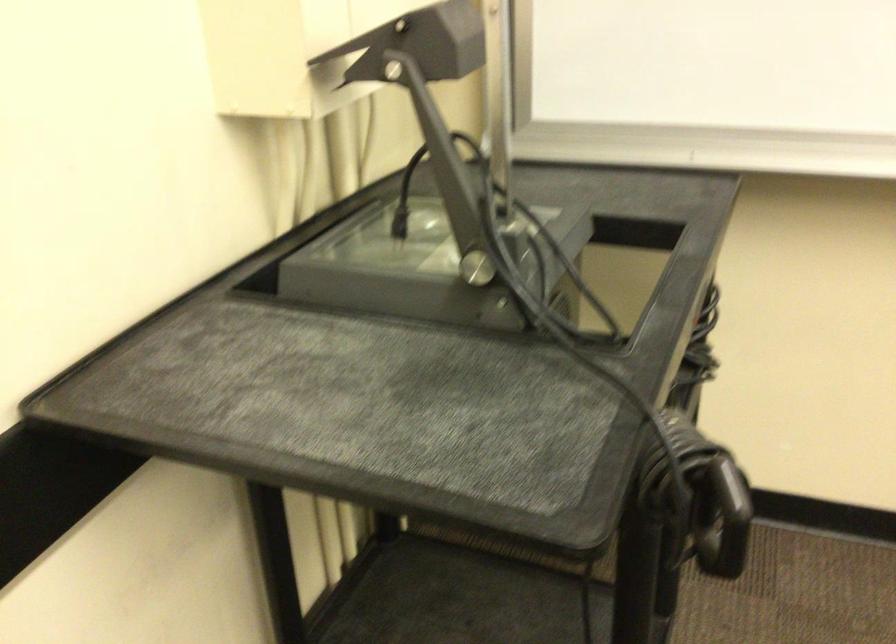
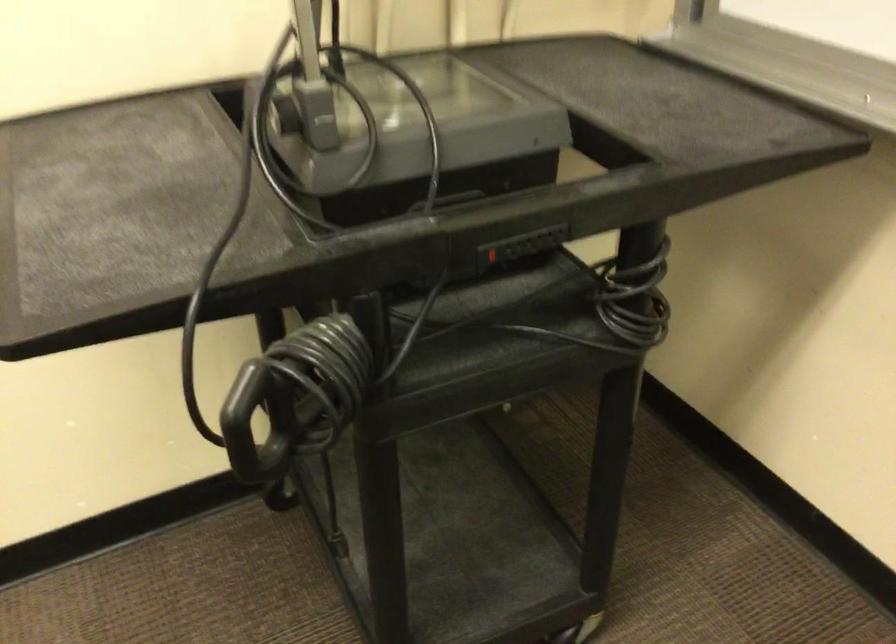
In the second image, find the point that corresponds to (x=750, y=514) in the first image.

(247, 418)